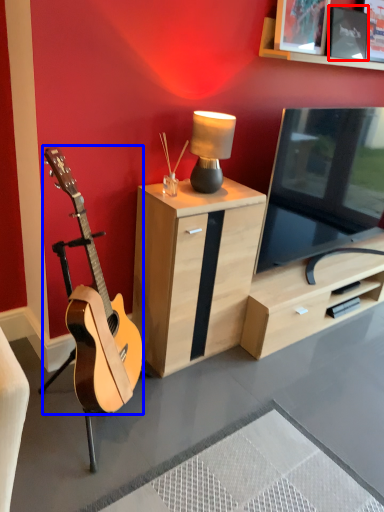
Question: Which of the following is the farthest to the observer, picture frame (highlighted by a red box) or guitar (highlighted by a blue box)?

Choices:
 (A) picture frame
 (B) guitar

Answer: (A)